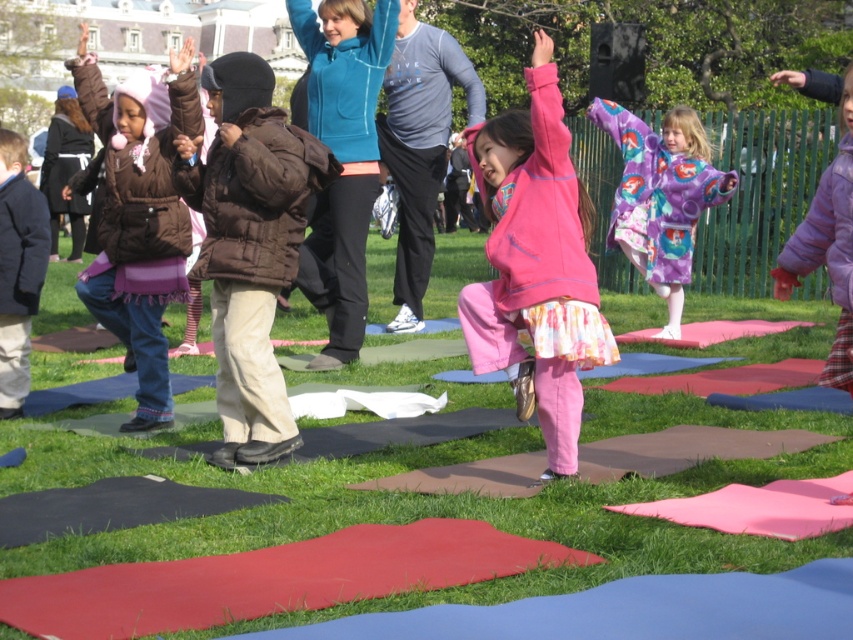
In the scene where children are exercising on colorful yoga mats in a grassy area, you notice the green grass at center and the purple fleece jacket at upper right. Which object is positioned to the left of the other?

The green grass at center is to the left of the purple fleece jacket at upper right.

You are a photographer trying to capture a closeup of the brown puffy jacket at center and the brown fuzzy coat at left. Since you want both subjects in focus, which one should you adjust your camera focus on first?

The brown puffy jacket at center has a smaller size compared to brown fuzzy coat at left, so you should focus on the brown puffy jacket at center first because it is smaller and requires more precise focus to capture details.